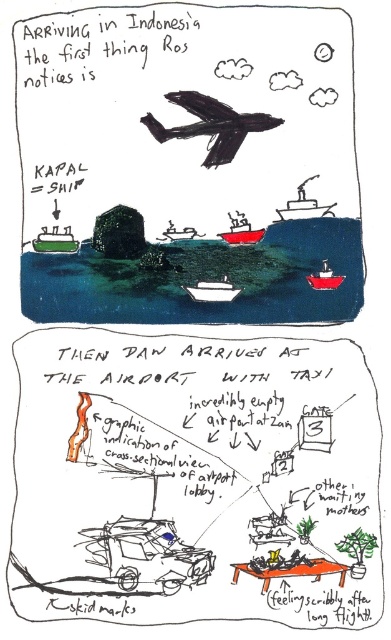
Is black matte airplane at upper center above red plastic boat at center?

Indeed, black matte airplane at upper center is positioned over red plastic boat at center.

Find the location of a particular element. This screenshot has width=391, height=640. black matte airplane at upper center is located at coordinates (211, 124).

Between point (152, 124) and point (245, 227), which one is positioned behind?

Positioned behind is point (245, 227).

I want to click on black matte airplane at upper center, so click(211, 124).

Does black matte airplane at upper center have a greater height compared to green matte boat at center?

Yes, black matte airplane at upper center is taller than green matte boat at center.

Who is shorter, black matte airplane at upper center or green matte boat at center?

green matte boat at center

Identify the location of black matte airplane at upper center. (211, 124).

Is red plastic boat at center smaller than metallic red boat at center?

No, red plastic boat at center is not smaller than metallic red boat at center.

Between point (247, 241) and point (326, 285), which one is positioned in front?

Point (326, 285) is more forward.

This screenshot has height=640, width=391. I want to click on red plastic boat at center, so click(240, 230).